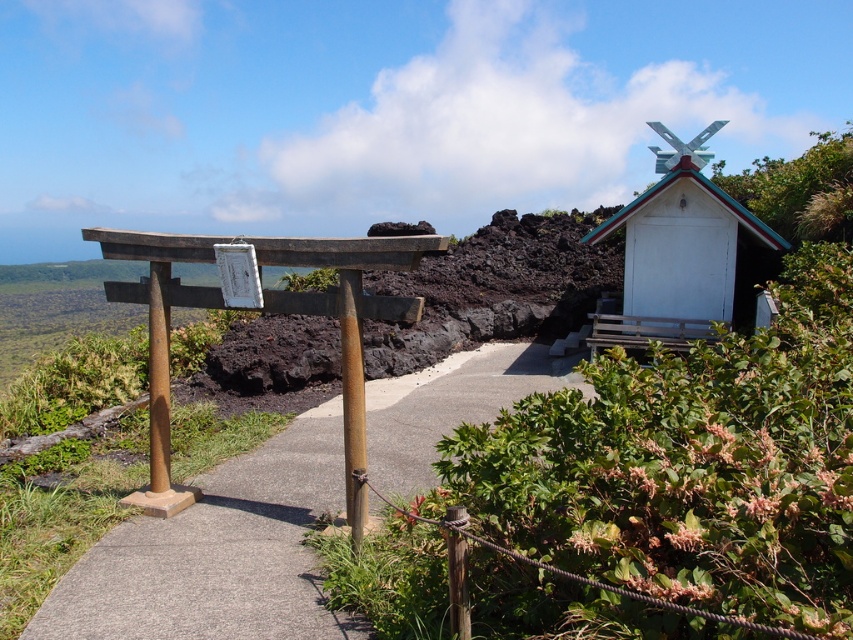
Consider the image. Can you confirm if concrete at center is positioned above white wooden shrine at upper right?

Actually, concrete at center is below white wooden shrine at upper right.

Between point (229, 563) and point (630, 212), which one is positioned in front?

Point (229, 563) is in front.

What are the coordinates of `concrete at center` in the screenshot? It's located at (218, 554).